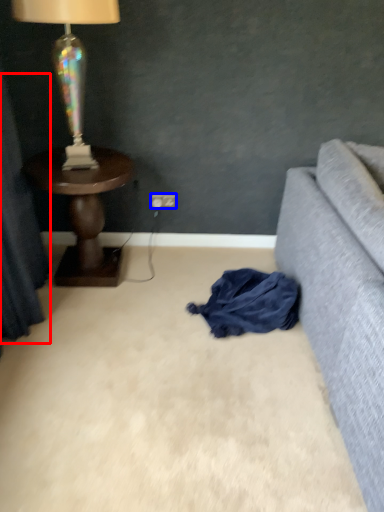
Question: Which object appears farthest to the camera in this image, curtain (highlighted by a red box) or power outlet (highlighted by a blue box)?

Choices:
 (A) curtain
 (B) power outlet

Answer: (B)